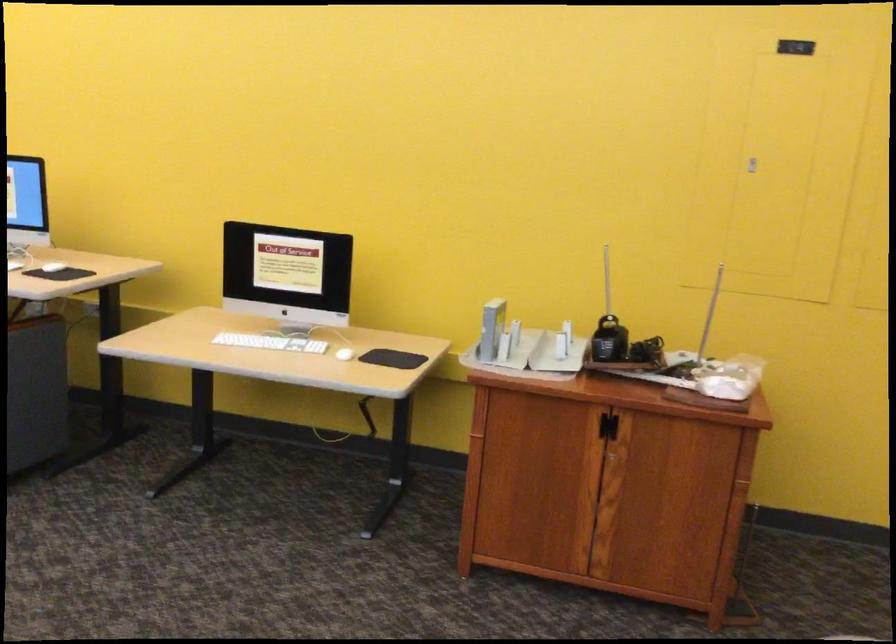
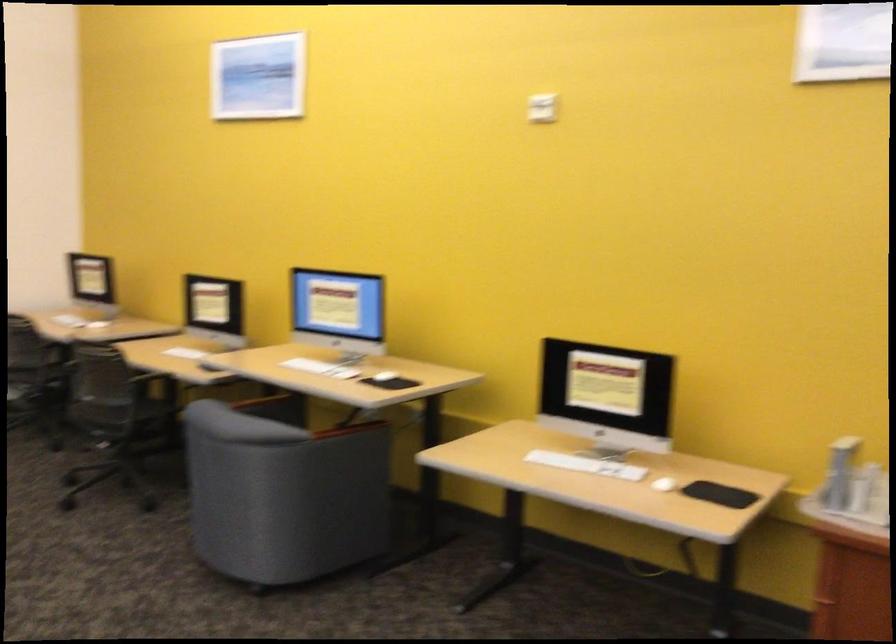
Question: The first image is from the beginning of the video and the second image is from the end. How did the camera likely rotate when shooting the video?

Choices:
 (A) Left
 (B) Right
 (C) Up
 (D) Down

Answer: (A)